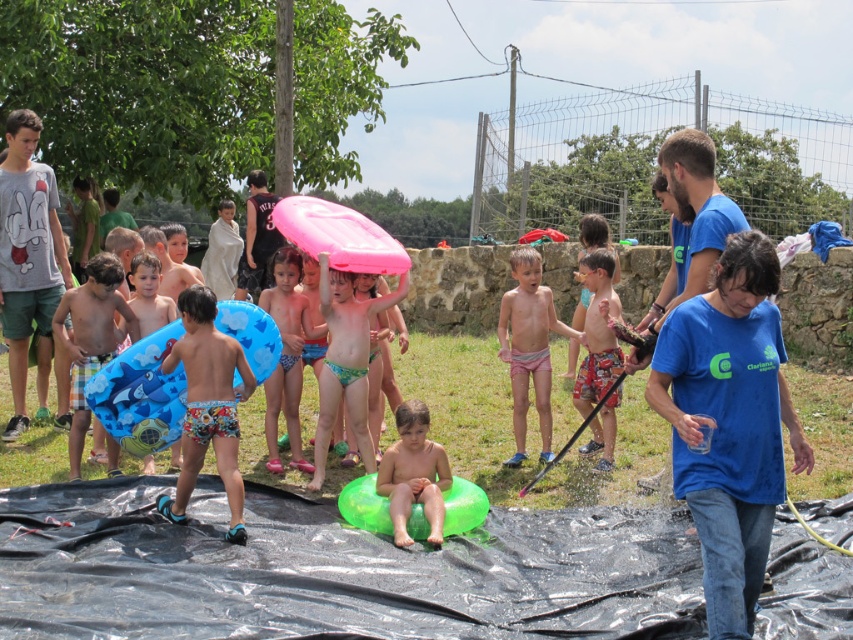
You are a parent trying to choose between the pink rubber ring at center and the printed cotton shorts at center for your child to play in the water. Which item can accommodate a wider child?

The pink rubber ring at center has a larger width than the printed cotton shorts at center, so it can accommodate a wider child.

Consider the image. You are a parent supervising the water play area. You notice two floating toys in the center of the scene. Which one is positioned higher, the pink rubber ring at center or the smooth green float at center?

The pink rubber ring at center is located above the smooth green float at center, so it is positioned higher.